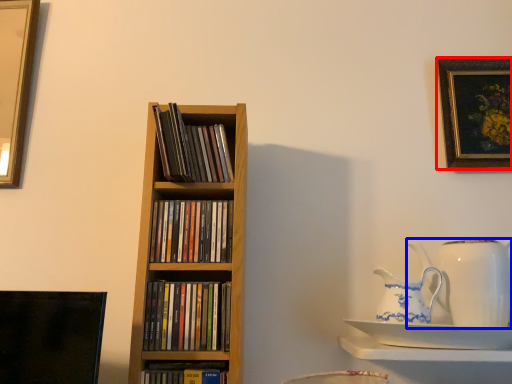
Question: Which object appears closest to the camera in this image, picture frame (highlighted by a red box) or jug (highlighted by a blue box)?

Choices:
 (A) picture frame
 (B) jug

Answer: (B)